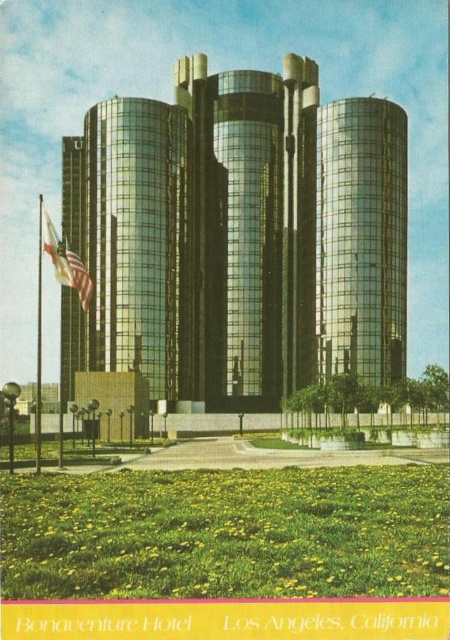
Does glossy glass tower at center have a smaller size compared to metallic flag pole at left?

Yes.

Does point (394, 116) lie behind point (37, 378)?

No, (394, 116) is in front of (37, 378).

Locate an element on the screen. The height and width of the screenshot is (640, 450). glossy glass tower at center is located at coordinates [361, 241].

Which is in front, point (139, 301) or point (379, 180)?

Point (139, 301) is more forward.

Is point (238, 372) positioned before point (346, 360)?

That is False.

Identify the location of shiny glass building at center. (238, 240).

Between point (73, 259) and point (36, 296), which one is positioned behind?

The point (36, 296) is behind.

Find the location of a particular element. The height and width of the screenshot is (640, 450). american flag at left is located at coordinates (66, 262).

This screenshot has width=450, height=640. In order to click on american flag at left in this screenshot , I will do `click(66, 262)`.